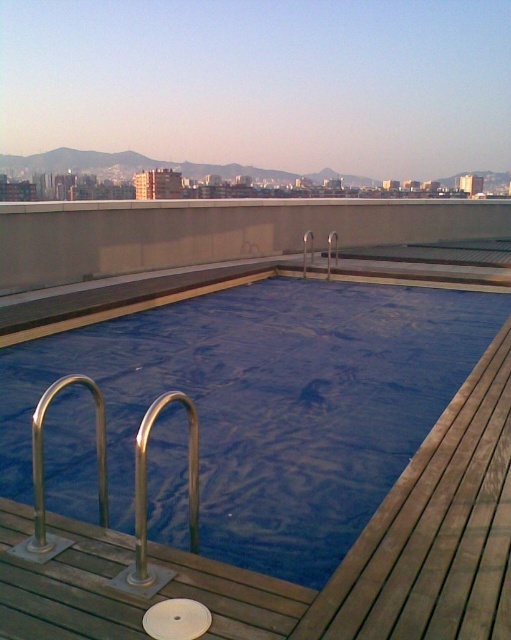
You are standing on the rooftop and want to take a photo of the blue rubber pool at center. If your camera can focus on objects up to 15 feet away, will you need to adjust your position to capture the pool clearly?

The blue rubber pool at center is 13.62 feet away from the camera, which is within the camera focus range of up to 15 feet. Therefore, no adjustment is needed to capture the pool clearly.

You are standing on the rooftop and want to jump into the pool. Which object, the blue rubber pool at center or the silver metallic rail at center, is closer to you?

The blue rubber pool at center is closer to you than the silver metallic rail at center.

You are designing a safety inspection report for the rooftop pool area. You need to note the relative sizes of the blue rubber pool at center and the silver metallic rail at center. Which one has a greater width?

The blue rubber pool at center has a greater width than the silver metallic rail at center according to the description.